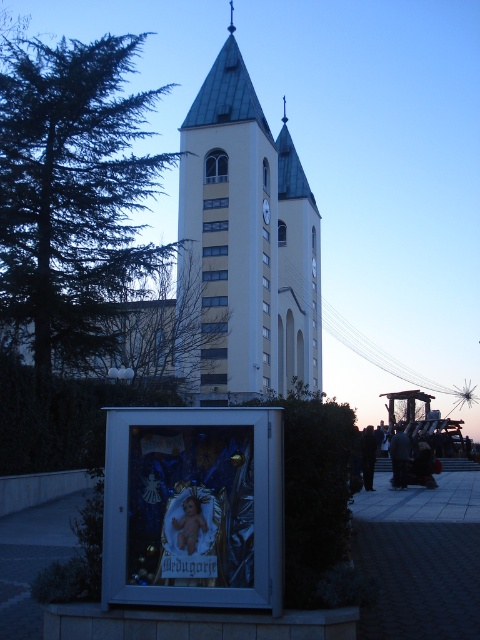
You are standing at the base of the church tower and want to place a small flag exactly at the point marked as point [252,108]. Given that the flag pole is 2 meters tall, will the top of the flag be visible from your current position?

The point [252,108] is 57.86 meters away from the viewer. Since the flag pole is only 2 meters tall, the top of the flag will be visible from your current position as there are no obstructions mentioned in the scene description.

You are standing in front of the church scene described. There is a yellow concrete tower at center. Where is the yellow concrete tower located in relation to the display case?

The yellow concrete tower at center is located at point [247,241], which is the central position in the image, so it is directly in front of you, centered between the display case which is in the foreground.

You are standing in front of the church tower and want to place a new plaque on the wall. The plaque needs to be placed below the white glossy clock at center but above the yellow concrete tower at center. Is this possible?

The yellow concrete tower at center is above the white glossy clock at center, so there is no space between them to place the plaque as requested.